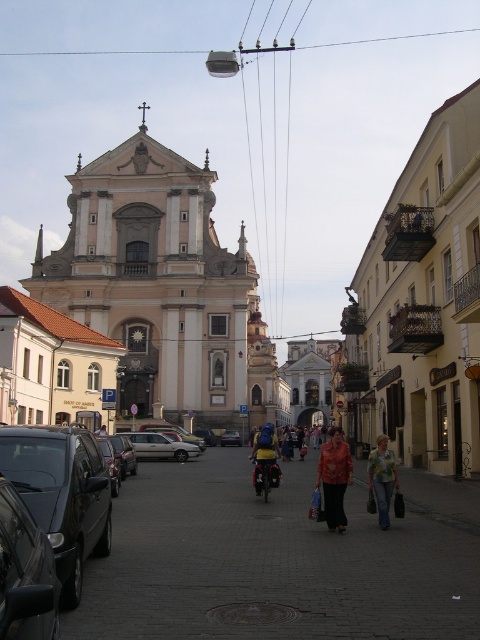
You are standing on the street in front of the grand church and want to walk towards the point marked as point (155, 51). However, there is an obstacle at point (239, 440). Can you reach your destination without going around the obstacle?

Point (155, 51) is behind point (239, 440), so you cannot reach the destination without going around the obstacle because the obstacle is in front of your path.

You are a delivery person trying to place a large package on the street. You see the leather jacket at center and the silver metallic sedan at center. Which object should you avoid placing the package near to ensure it doesn

The leather jacket at center is bigger than the silver metallic sedan at center, so you should avoid placing the package near the leather jacket at center to ensure there is enough space.